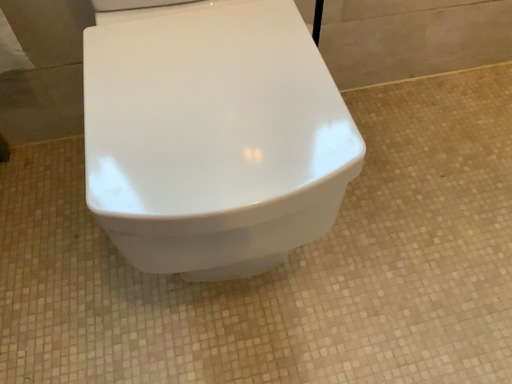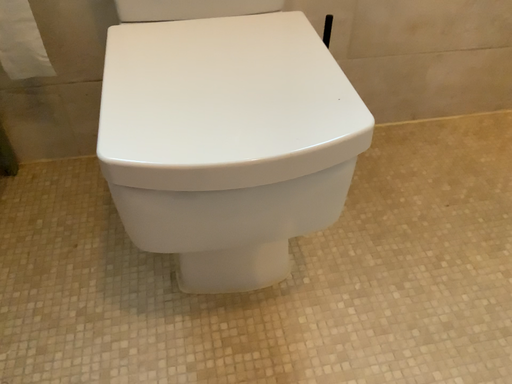
Question: How did the camera likely rotate when shooting the video?

Choices:
 (A) rotated upward
 (B) rotated downward

Answer: (A)